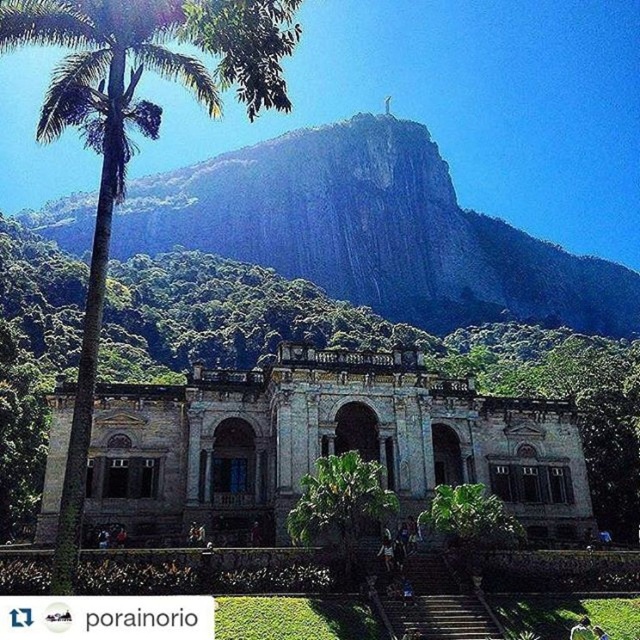
Question: Among these objects, which one is nearest to the camera?

Choices:
 (A) green leafy palm tree at left
 (B) weathered stone palace at center
 (C) green leafy tree at center
 (D) black fabric person at center

Answer: (A)

Question: Can you confirm if green leafy palm tree at left is positioned below green leafy tree at center?

Choices:
 (A) yes
 (B) no

Answer: (B)

Question: Can you confirm if rugged stone mountain at upper center is positioned to the right of green leafy palm tree at left?

Choices:
 (A) no
 (B) yes

Answer: (B)

Question: Considering the real-world distances, which object is closest to the green leafy tree at center?

Choices:
 (A) weathered stone palace at center
 (B) black fabric person at center

Answer: (A)

Question: From the image, what is the correct spatial relationship of weathered stone palace at center in relation to green leafy palm tree at left?

Choices:
 (A) below
 (B) above

Answer: (A)

Question: Which object is farther from the camera taking this photo?

Choices:
 (A) weathered stone palace at center
 (B) rugged stone mountain at upper center
 (C) green leafy tree at center
 (D) green leafy palm tree at left

Answer: (B)